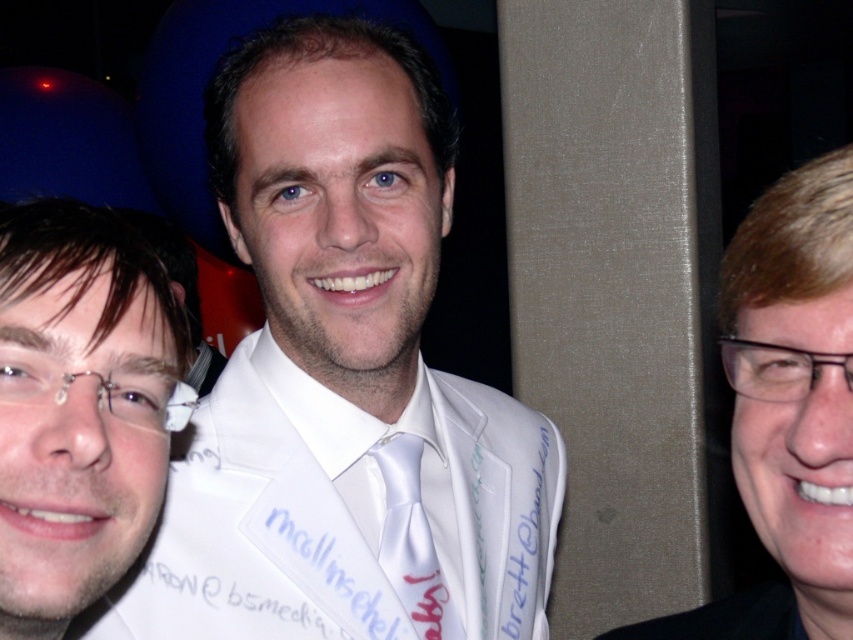
Question: Does black glossy hair at right have a larger size compared to white satin tie at center?

Choices:
 (A) no
 (B) yes

Answer: (B)

Question: Does white satin suit at center come behind black glossy hair at right?

Choices:
 (A) yes
 (B) no

Answer: (A)

Question: Considering the real-world distances, which object is farthest from the white satin suit at center?

Choices:
 (A) black glossy hair at right
 (B) matte white shirt at center

Answer: (A)

Question: Does matte white shirt at center appear on the left side of white satin tie at center?

Choices:
 (A) yes
 (B) no

Answer: (A)

Question: Which is farther from the white satin suit at center?

Choices:
 (A) white satin tie at center
 (B) black glossy hair at right

Answer: (B)

Question: Among these objects, which one is farthest from the camera?

Choices:
 (A) white satin tie at center
 (B) matte white shirt at center
 (C) white satin suit at center
 (D) black glossy hair at right

Answer: (A)